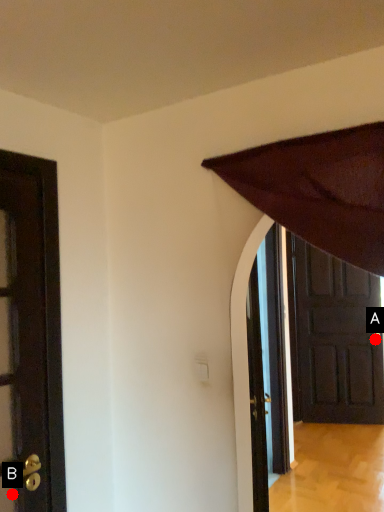
Question: Two points are circled on the image, labeled by A and B beside each circle. Which point is closer to the camera?

Choices:
 (A) A is closer
 (B) B is closer

Answer: (B)